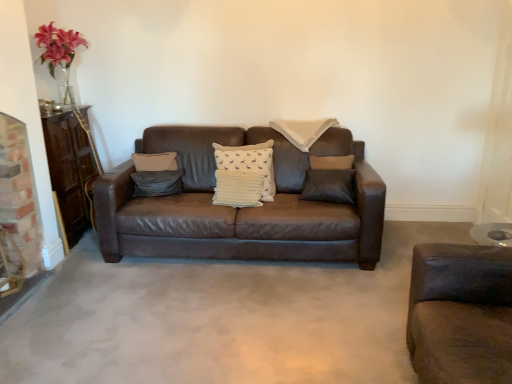
Image resolution: width=512 pixels, height=384 pixels. What do you see at coordinates (156, 183) in the screenshot?
I see `suede gray pillow at center, which is counted as the 2th pillow, starting from the right` at bounding box center [156, 183].

Identify the location of gray concrete at center. This screenshot has width=512, height=384. (220, 319).

You are a GUI agent. You are given a task and a screenshot of the screen. Output one action in this format:
    pyautogui.click(x=<x>, y=<y>)
    Task: Click on the suede gray pillow at center, which is counted as the 2th pillow, starting from the right
    
    Given the screenshot: What is the action you would take?
    [156, 183]

In order to click on concrete that is in front of the white dotted fabric pillow at center, the 2th pillow when ordered from left to right in this screenshot , I will do `click(220, 319)`.

Is gray concrete at center in front of or behind white dotted fabric pillow at center, the 2th pillow when ordered from left to right, in the image?

gray concrete at center is in front of white dotted fabric pillow at center, the 2th pillow when ordered from left to right.

Is gray concrete at center bigger or smaller than white dotted fabric pillow at center, marked as the 1th pillow in a right-to-left arrangement?

Clearly, gray concrete at center is larger in size than white dotted fabric pillow at center, marked as the 1th pillow in a right-to-left arrangement.

Can we say gray concrete at center lies outside white dotted fabric pillow at center, marked as the 1th pillow in a right-to-left arrangement?

Yes.

Does gray concrete at center appear on the right side of suede gray pillow at center, which is counted as the 2th pillow, starting from the right?

Correct, you'll find gray concrete at center to the right of suede gray pillow at center, which is counted as the 2th pillow, starting from the right.

From the image's perspective, is gray concrete at center located above or below suede gray pillow at center, which is counted as the 2th pillow, starting from the right?

gray concrete at center is situated lower than suede gray pillow at center, which is counted as the 2th pillow, starting from the right, in the image.

Is gray concrete at center oriented away from suede gray pillow at center, the 1th pillow positioned from the left?

No, suede gray pillow at center, the 1th pillow positioned from the left, is not at the back of gray concrete at center.

Are white dotted fabric pillow at center, the 2th pillow when ordered from left to right, and gray concrete at center beside each other?

There is a gap between white dotted fabric pillow at center, the 2th pillow when ordered from left to right, and gray concrete at center.

From the image's perspective, relative to gray concrete at center, is white dotted fabric pillow at center, marked as the 1th pillow in a right-to-left arrangement, above or below?

Clearly, from the image's perspective, white dotted fabric pillow at center, marked as the 1th pillow in a right-to-left arrangement, is above gray concrete at center.

Is white dotted fabric pillow at center, the 2th pillow when ordered from left to right, inside or outside of gray concrete at center?

white dotted fabric pillow at center, the 2th pillow when ordered from left to right, is not enclosed by gray concrete at center.

Is white dotted fabric pillow at center, the 2th pillow when ordered from left to right, looking in the opposite direction of gray concrete at center?

No, gray concrete at center is not at the back of white dotted fabric pillow at center, the 2th pillow when ordered from left to right.

From a real-world perspective, between white dotted fabric pillow at center, marked as the 1th pillow in a right-to-left arrangement, and suede gray pillow at center, the 1th pillow positioned from the left, who is vertically higher?

In real-world perspective, white dotted fabric pillow at center, marked as the 1th pillow in a right-to-left arrangement, is above.

In terms of width, does white dotted fabric pillow at center, marked as the 1th pillow in a right-to-left arrangement, look wider or thinner when compared to suede gray pillow at center, which is counted as the 2th pillow, starting from the right?

Considering their sizes, white dotted fabric pillow at center, marked as the 1th pillow in a right-to-left arrangement, looks broader than suede gray pillow at center, which is counted as the 2th pillow, starting from the right.

Between white dotted fabric pillow at center, marked as the 1th pillow in a right-to-left arrangement, and suede gray pillow at center, the 1th pillow positioned from the left, which one has larger size?

Bigger between the two is white dotted fabric pillow at center, marked as the 1th pillow in a right-to-left arrangement.

Does white dotted fabric pillow at center, marked as the 1th pillow in a right-to-left arrangement, turn towards suede gray pillow at center, the 1th pillow positioned from the left?

No, white dotted fabric pillow at center, marked as the 1th pillow in a right-to-left arrangement, is not aimed at suede gray pillow at center, the 1th pillow positioned from the left.

Can you tell me how much suede gray pillow at center, which is counted as the 2th pillow, starting from the right, and gray concrete at center differ in facing direction?

The angle between the facing direction of suede gray pillow at center, which is counted as the 2th pillow, starting from the right, and the facing direction of gray concrete at center is 16.7 degrees.

From the picture: Who is shorter, suede gray pillow at center, the 1th pillow positioned from the left, or gray concrete at center?

With less height is gray concrete at center.

Considering the sizes of objects suede gray pillow at center, which is counted as the 2th pillow, starting from the right, and gray concrete at center in the image provided, who is bigger, suede gray pillow at center, which is counted as the 2th pillow, starting from the right, or gray concrete at center?

gray concrete at center.

Is suede gray pillow at center, the 1th pillow positioned from the left, further to the viewer compared to gray concrete at center?

Yes, it is behind gray concrete at center.

Consider the image. From the image's perspective, is suede gray pillow at center, the 1th pillow positioned from the left, under white dotted fabric pillow at center, marked as the 1th pillow in a right-to-left arrangement?

Yes, from the image's perspective, suede gray pillow at center, the 1th pillow positioned from the left, is beneath white dotted fabric pillow at center, marked as the 1th pillow in a right-to-left arrangement.

From the picture: From a real-world perspective, relative to white dotted fabric pillow at center, marked as the 1th pillow in a right-to-left arrangement, is suede gray pillow at center, which is counted as the 2th pillow, starting from the right, vertically above or below?

In terms of real-world spatial position, suede gray pillow at center, which is counted as the 2th pillow, starting from the right, is below white dotted fabric pillow at center, marked as the 1th pillow in a right-to-left arrangement.

Is suede gray pillow at center, the 1th pillow positioned from the left, bigger or smaller than white dotted fabric pillow at center, marked as the 1th pillow in a right-to-left arrangement?

Considering their sizes, suede gray pillow at center, the 1th pillow positioned from the left, takes up less space than white dotted fabric pillow at center, marked as the 1th pillow in a right-to-left arrangement.

Considering the sizes of suede gray pillow at center, the 1th pillow positioned from the left, and white dotted fabric pillow at center, the 2th pillow when ordered from left to right, in the image, is suede gray pillow at center, the 1th pillow positioned from the left, taller or shorter than white dotted fabric pillow at center, the 2th pillow when ordered from left to right,?

Clearly, suede gray pillow at center, the 1th pillow positioned from the left, is shorter compared to white dotted fabric pillow at center, the 2th pillow when ordered from left to right.

Where is `the 1st pillow behind the gray concrete at center, counting from the anchor's position`? the 1st pillow behind the gray concrete at center, counting from the anchor's position is located at coordinates 250,163.

Identify the location of the 1st pillow above the gray concrete at center (from the image's perspective). This screenshot has height=384, width=512. (156, 183).

Which object lies nearer to the anchor point white dotted fabric pillow at center, marked as the 1th pillow in a right-to-left arrangement, gray concrete at center or suede gray pillow at center, which is counted as the 2th pillow, starting from the right?

The object closer to white dotted fabric pillow at center, marked as the 1th pillow in a right-to-left arrangement, is suede gray pillow at center, which is counted as the 2th pillow, starting from the right.

Estimate the real-world distances between objects in this image. Which object is further from white dotted fabric pillow at center, marked as the 1th pillow in a right-to-left arrangement, suede gray pillow at center, the 1th pillow positioned from the left, or gray concrete at center?

Based on the image, gray concrete at center appears to be further to white dotted fabric pillow at center, marked as the 1th pillow in a right-to-left arrangement.

Looking at the image, which one is located closer to suede gray pillow at center, which is counted as the 2th pillow, starting from the right, white dotted fabric pillow at center, the 2th pillow when ordered from left to right, or gray concrete at center?

The object closer to suede gray pillow at center, which is counted as the 2th pillow, starting from the right, is white dotted fabric pillow at center, the 2th pillow when ordered from left to right.

Based on the photo, considering their positions, is suede gray pillow at center, the 1th pillow positioned from the left, positioned further to gray concrete at center than white dotted fabric pillow at center, the 2th pillow when ordered from left to right?

Among the two, suede gray pillow at center, the 1th pillow positioned from the left, is located further to gray concrete at center.

Estimate the real-world distances between objects in this image. Which object is closer to suede gray pillow at center, the 1th pillow positioned from the left, gray concrete at center or white dotted fabric pillow at center, the 2th pillow when ordered from left to right?

white dotted fabric pillow at center, the 2th pillow when ordered from left to right.

Estimate the real-world distances between objects in this image. Which object is further from gray concrete at center, white dotted fabric pillow at center, the 2th pillow when ordered from left to right, or suede gray pillow at center, which is counted as the 2th pillow, starting from the right?

suede gray pillow at center, which is counted as the 2th pillow, starting from the right, is positioned further to the anchor gray concrete at center.

Image resolution: width=512 pixels, height=384 pixels. What are the coordinates of `pillow positioned between gray concrete at center and suede gray pillow at center, which is counted as the 2th pillow, starting from the right, from near to far` in the screenshot? It's located at (250, 163).